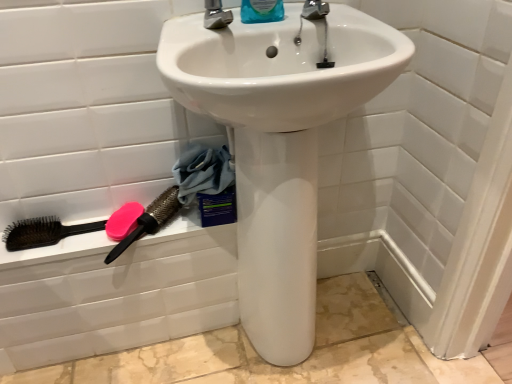
Question: Is blue fabric at lower left placed right next to blue plastic bottle at upper center?

Choices:
 (A) yes
 (B) no

Answer: (B)

Question: From a real-world perspective, does blue fabric at lower left stand above blue plastic bottle at upper center?

Choices:
 (A) yes
 (B) no

Answer: (B)

Question: Considering the relative sizes of blue fabric at lower left and blue plastic bottle at upper center in the image provided, is blue fabric at lower left thinner than blue plastic bottle at upper center?

Choices:
 (A) yes
 (B) no

Answer: (B)

Question: From a real-world perspective, is blue fabric at lower left physically below blue plastic bottle at upper center?

Choices:
 (A) yes
 (B) no

Answer: (A)

Question: Could blue plastic bottle at upper center be considered to be inside blue fabric at lower left?

Choices:
 (A) yes
 (B) no

Answer: (B)

Question: Is blue fabric at lower left positioned far away from blue plastic bottle at upper center?

Choices:
 (A) yes
 (B) no

Answer: (B)

Question: Considering the relative sizes of pink matte soap at lower left and white glossy sink at center in the image provided, is pink matte soap at lower left shorter than white glossy sink at center?

Choices:
 (A) yes
 (B) no

Answer: (A)

Question: Can you confirm if pink matte soap at lower left is thinner than white glossy sink at center?

Choices:
 (A) no
 (B) yes

Answer: (B)

Question: Is pink matte soap at lower left aimed at white glossy sink at center?

Choices:
 (A) yes
 (B) no

Answer: (B)

Question: Is pink matte soap at lower left looking in the opposite direction of white glossy sink at center?

Choices:
 (A) yes
 (B) no

Answer: (B)

Question: Is pink matte soap at lower left bigger than white glossy sink at center?

Choices:
 (A) yes
 (B) no

Answer: (B)

Question: From a real-world perspective, does pink matte soap at lower left stand above white glossy sink at center?

Choices:
 (A) yes
 (B) no

Answer: (B)

Question: Is brown bristle brush at lower left, the 1th brush in the left-to-right sequence, oriented away from pink rubber brush at lower left, acting as the 3th brush starting from the left?

Choices:
 (A) yes
 (B) no

Answer: (B)